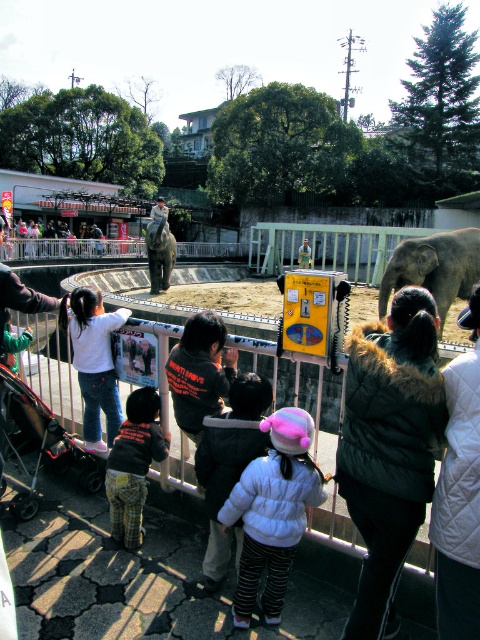
Question: In this image, where is white quilted jacket at center located relative to light brown fur horse at center?

Choices:
 (A) above
 (B) below

Answer: (B)

Question: Which object is farther from the camera taking this photo?

Choices:
 (A) gray matte elephant at center
 (B) gray textured elephant at center
 (C) white quilted jacket at center
 (D) dark gray fleece jacket at center

Answer: (B)

Question: Which of these objects is positioned farthest from the dark gray fleece jacket at center?

Choices:
 (A) light brown fur horse at center
 (B) black plastic baby carriage at lower left
 (C) white cotton shirt at left
 (D) dark green fur coat at center

Answer: (A)

Question: Estimate the real-world distances between objects in this image. Which object is closer to the dark gray fleece jacket at center?

Choices:
 (A) gray matte elephant at center
 (B) dark green fur coat at center
 (C) gray textured elephant at center

Answer: (B)

Question: In this image, where is flannel plaid pants at center located relative to gray matte elephant at center?

Choices:
 (A) above
 (B) below

Answer: (B)

Question: Does white quilted jacket at center appear on the right side of gray matte elephant at center?

Choices:
 (A) no
 (B) yes

Answer: (A)